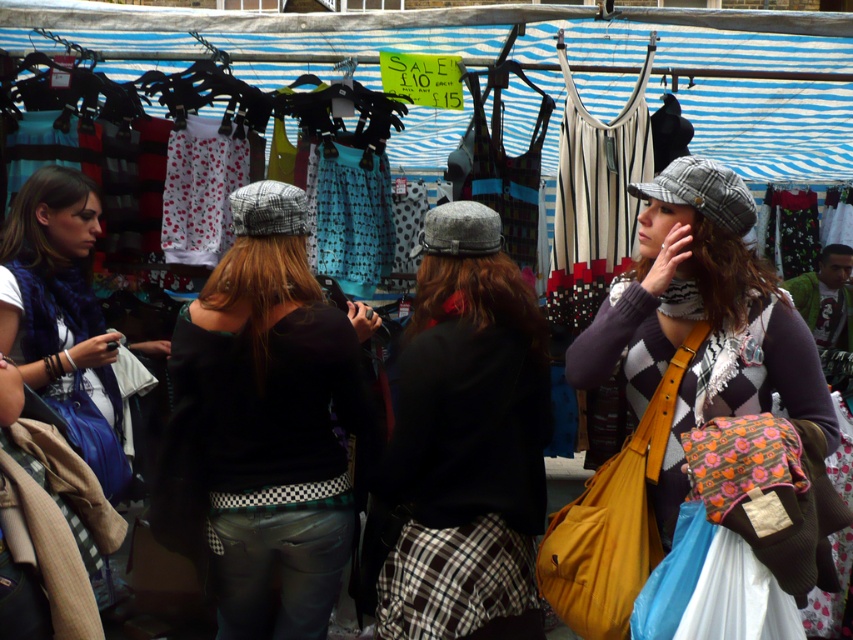
Consider the image. Is black checkered belt at center taller than black woolen sweater at center?

Yes, black checkered belt at center is taller than black woolen sweater at center.

Which is behind, point (257, 419) or point (422, 348)?

Point (422, 348)

At what (x,y) coordinates should I click in order to perform the action: click on black checkered belt at center. Please return your answer as a coordinate pair (x, y). This screenshot has width=853, height=640. Looking at the image, I should click on (264, 426).

Is black woolen sweater at center taller than plaid wool cap at center?

Correct, black woolen sweater at center is much taller as plaid wool cap at center.

Between black woolen sweater at center and plaid wool cap at center, which one is positioned lower?

Positioned lower is black woolen sweater at center.

Is point (495, 524) positioned after point (663, 561)?

Yes.

Find the location of a particular element. The width and height of the screenshot is (853, 640). black woolen sweater at center is located at coordinates pyautogui.click(x=466, y=442).

Who is lower down, black checkered belt at center or plaid wool cap at center?

black checkered belt at center

Is black checkered belt at center positioned in front of plaid wool cap at center?

No, it is not.

Between point (277, 384) and point (666, 285), which one is positioned in front?

Point (666, 285) is more forward.

Find the location of `black checkered belt at center`. black checkered belt at center is located at coordinates (264, 426).